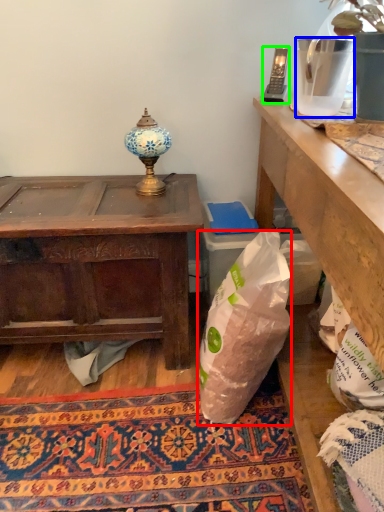
Question: Based on their relative distances, which object is nearer to plastic bag (highlighted by a red box)? Choose from vase (highlighted by a blue box) and mobile phone (highlighted by a green box).

Choices:
 (A) vase
 (B) mobile phone

Answer: (A)